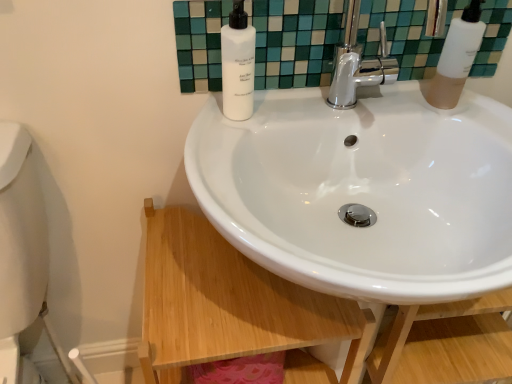
Question: Can you confirm if white glossy sink at center is smaller than white matte bottle at upper center, which ranks as the second soap dispenser in right-to-left order?

Choices:
 (A) yes
 (B) no

Answer: (B)

Question: Is white glossy sink at center taller than white matte bottle at upper center, the first soap dispenser when ordered from left to right?

Choices:
 (A) no
 (B) yes

Answer: (B)

Question: Is the depth of white glossy sink at center less than that of white matte bottle at upper center, the first soap dispenser when ordered from left to right?

Choices:
 (A) yes
 (B) no

Answer: (A)

Question: Is white glossy sink at center positioned behind white matte bottle at upper center, which ranks as the second soap dispenser in right-to-left order?

Choices:
 (A) no
 (B) yes

Answer: (A)

Question: Is white glossy sink at center far from white matte bottle at upper center, the first soap dispenser when ordered from left to right?

Choices:
 (A) no
 (B) yes

Answer: (A)

Question: Would you say white glossy sink at center is outside white matte bottle at upper center, the first soap dispenser when ordered from left to right?

Choices:
 (A) no
 (B) yes

Answer: (B)

Question: Considering the relative sizes of white glossy sink at center and white glossy wood at lower center in the image provided, is white glossy sink at center smaller than white glossy wood at lower center?

Choices:
 (A) yes
 (B) no

Answer: (B)

Question: Is white glossy wood at lower center surrounded by white glossy sink at center?

Choices:
 (A) yes
 (B) no

Answer: (A)

Question: From the image's perspective, is white glossy sink at center over white glossy wood at lower center?

Choices:
 (A) yes
 (B) no

Answer: (A)

Question: Is white glossy sink at center looking in the opposite direction of white glossy wood at lower center?

Choices:
 (A) no
 (B) yes

Answer: (B)

Question: Considering the relative positions of white glossy sink at center and white glossy wood at lower center in the image provided, is white glossy sink at center to the left of white glossy wood at lower center from the viewer's perspective?

Choices:
 (A) yes
 (B) no

Answer: (B)

Question: Does white glossy sink at center have a lesser width compared to white glossy wood at lower center?

Choices:
 (A) yes
 (B) no

Answer: (B)

Question: Is white matte bottle at upper center, which ranks as the second soap dispenser in right-to-left order, taller than white glossy mirror at upper center?

Choices:
 (A) yes
 (B) no

Answer: (A)